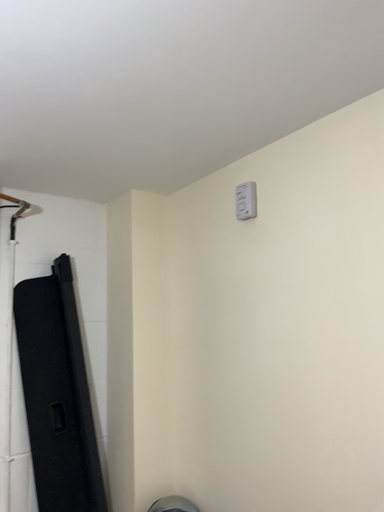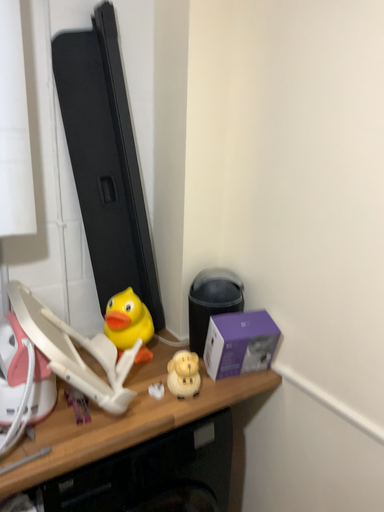
Question: Which way did the camera rotate in the video?

Choices:
 (A) rotated downward
 (B) rotated upward

Answer: (A)